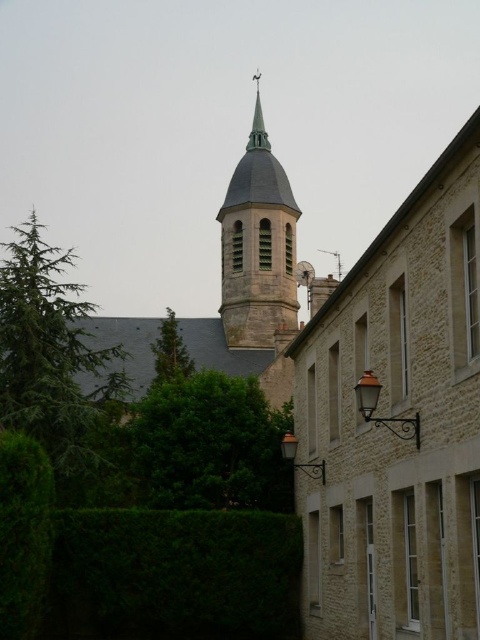
You are an architect analyzing the building facade. You need to determine which of the two structures, the smooth gray steeple at upper left or the smooth copper spire at upper center, has a greater width. Based on the scene, which one is wider?

The smooth gray steeple at upper left is wider than the smooth copper spire at upper center according to the description provided.

You are an architect evaluating the proportions of the building. Which of the two elements, the smooth gray steeple at upper left or the smooth copper spire at upper center, would you say is bigger in size?

The smooth gray steeple at upper left is larger in size than the smooth copper spire at upper center.

You are standing in the urban scene and want to find a place to sit under shade. Which object would provide more coverage from the sun, the green leafy tree at center or the green leafy hedge at lower left?

The green leafy tree at center is located above the green leafy hedge at lower left, so it would provide more shade coverage.